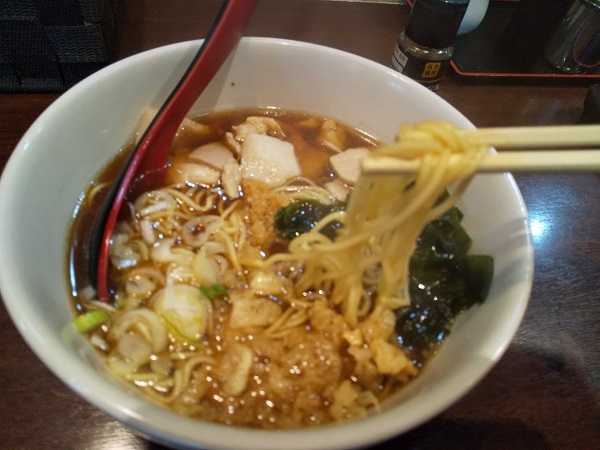
The image size is (600, 450). Identify the location of edges of bowl. (58, 142), (50, 308), (442, 368), (499, 221), (307, 92).